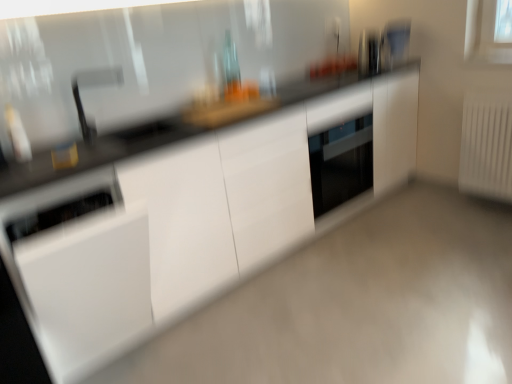
Where is `free location above white glossy cabinet at center (from a real-world perspective)`? The width and height of the screenshot is (512, 384). free location above white glossy cabinet at center (from a real-world perspective) is located at coordinates (354, 296).